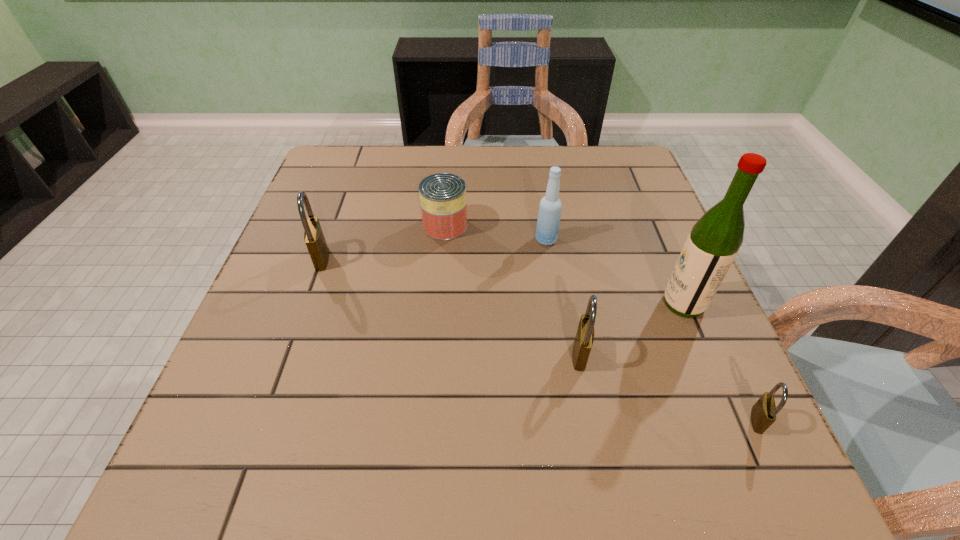
Choose which object is the fifth nearest neighbor to the can. Please provide its 2D coordinates. Your answer should be formatted as a tuple, i.e. [(x, y)], where the tuple contains the x and y coordinates of a point satisfying the conditions above.

[(763, 414)]

Point out which padlock is positioned as the nearest to the nearest object. Please provide its 2D coordinates. Your answer should be formatted as a tuple, i.e. [(x, y)], where the tuple contains the x and y coordinates of a point satisfying the conditions above.

[(584, 338)]

Where is `padlock object that ranks as the third closest to the bottle`? This screenshot has height=540, width=960. padlock object that ranks as the third closest to the bottle is located at coordinates (763, 414).